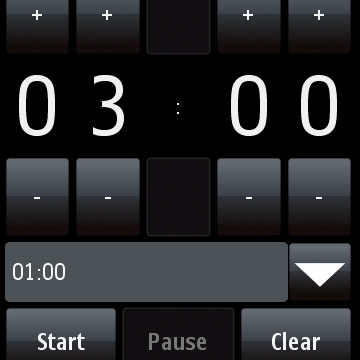
Where is `display`? The width and height of the screenshot is (360, 360). display is located at coordinates (41, 27), (33, 190), (33, 104), (110, 109), (244, 105), (327, 106), (94, 279).